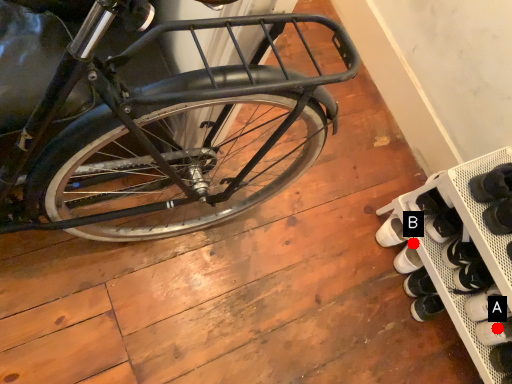
Question: Two points are circled on the image, labeled by A and B beside each circle. Which point appears closest to the camera in this image?

Choices:
 (A) A is closer
 (B) B is closer

Answer: (A)